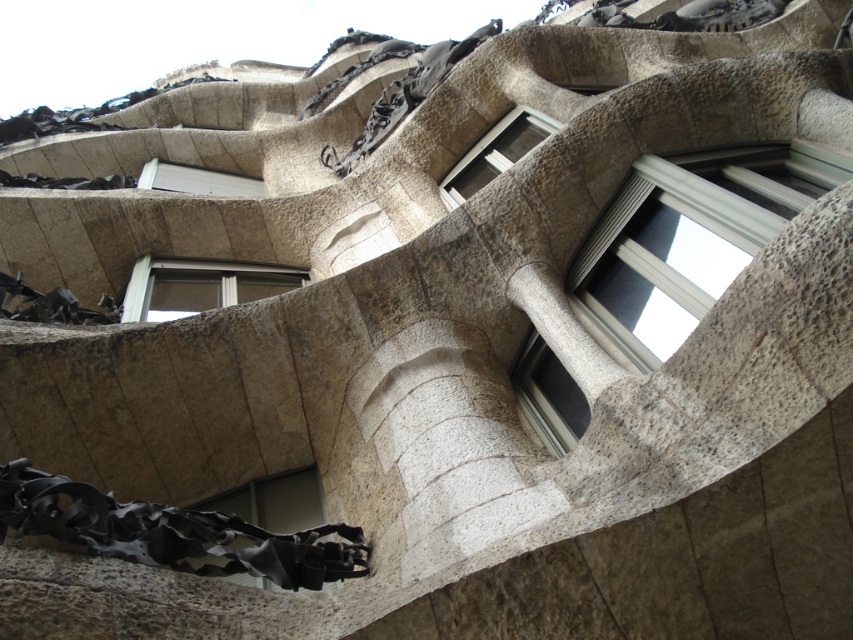
In order to click on matte stone window at center in this screenshot , I will do `click(199, 285)`.

Where is `matte stone window at center`? The image size is (853, 640). matte stone window at center is located at coordinates (199, 285).

This screenshot has height=640, width=853. In order to click on matte stone window at center in this screenshot , I will do `click(199, 285)`.

Is point (469, 168) positioned behind point (163, 176)?

No, it is not.

Who is more forward, (460, 198) or (163, 168)?

Point (460, 198) is in front.

Locate an element on the screen. clear glass window at upper center is located at coordinates (495, 152).

Is clear glass window at center to the left of white plastic window at upper center from the viewer's perspective?

No, clear glass window at center is not to the left of white plastic window at upper center.

Can you confirm if clear glass window at center is taller than white plastic window at upper center?

Indeed, clear glass window at center has a greater height compared to white plastic window at upper center.

Describe the element at coordinates (549, 396) in the screenshot. The width and height of the screenshot is (853, 640). I see `clear glass window at center` at that location.

Find the location of `clear glass window at center`. clear glass window at center is located at coordinates (549, 396).